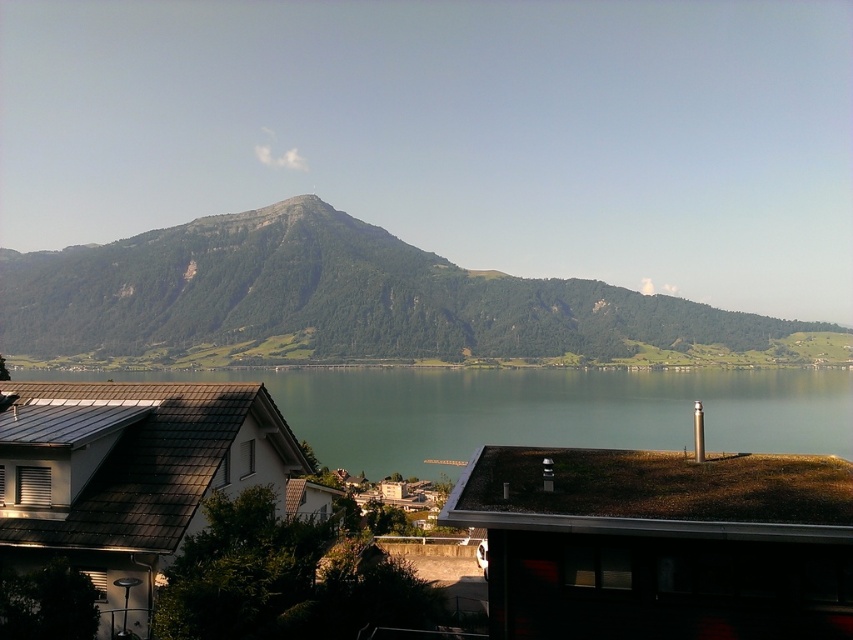
Question: Does green textured mountain at center come behind green water at center?

Choices:
 (A) yes
 (B) no

Answer: (A)

Question: Does green textured mountain at center appear under green water at center?

Choices:
 (A) no
 (B) yes

Answer: (A)

Question: Which of the following is the farthest from the observer?

Choices:
 (A) green water at center
 (B) green textured mountain at center

Answer: (B)

Question: Which of the following is the farthest from the observer?

Choices:
 (A) (209, 234)
 (B) (689, 420)

Answer: (A)

Question: Can you confirm if green textured mountain at center is positioned to the right of green water at center?

Choices:
 (A) no
 (B) yes

Answer: (A)